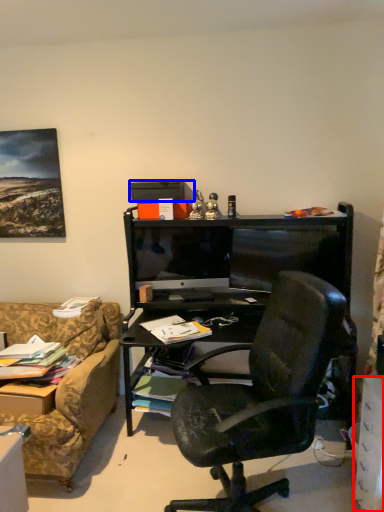
Question: Which object appears farthest to the camera in this image, drawer (highlighted by a red box) or box (highlighted by a blue box)?

Choices:
 (A) drawer
 (B) box

Answer: (B)